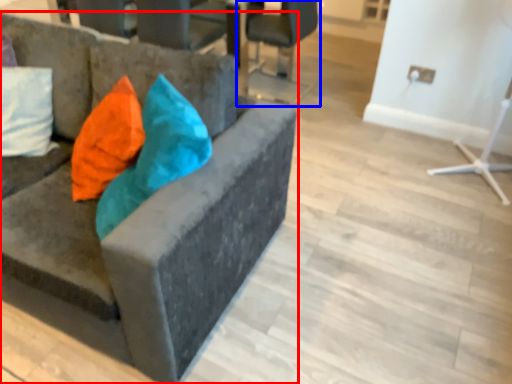
Question: Among these objects, which one is nearest to the camera, chair (highlighted by a red box) or chair (highlighted by a blue box)?

Choices:
 (A) chair
 (B) chair

Answer: (A)